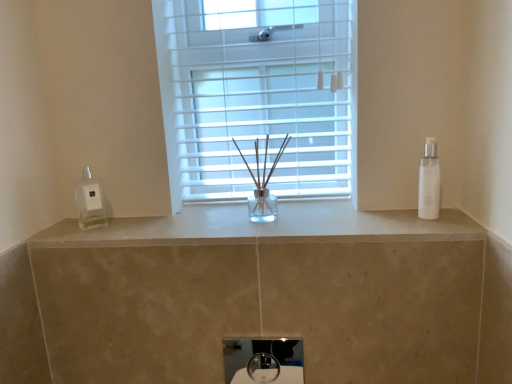
Identify the location of empty space that is ontop of white marble counter at center. This screenshot has height=384, width=512. (253, 215).